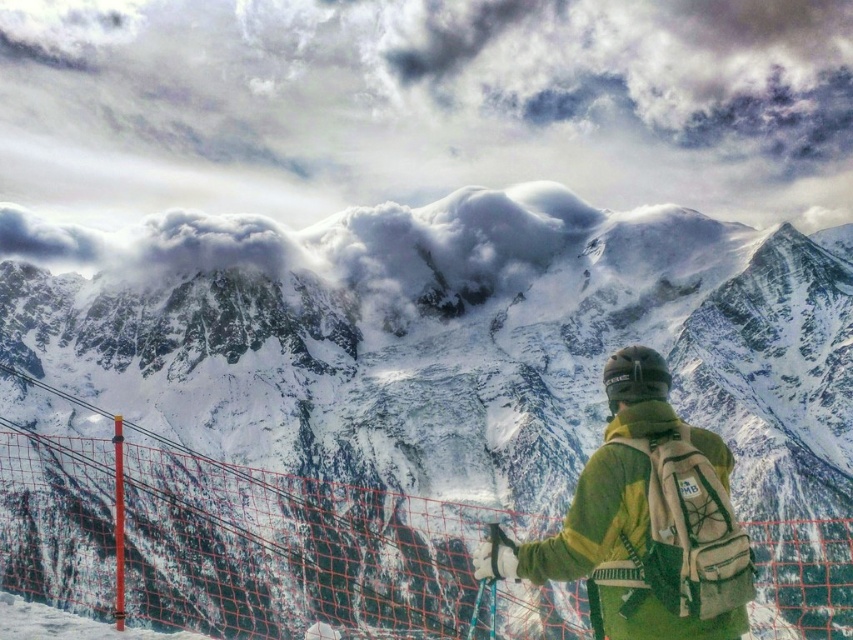
You are a photographer positioned at the camera location in this alpine scene. You want to capture a closeup shot of the point at coordinate point (316, 323). Given that your telephoto lens has a maximum focal length of 200mm, can you determine if you can achieve this closeup without moving closer?

The distance between point (316, 323) and the camera is 155.49 meters. With a telephoto lens of 200mm, you can capture a closeup of the point at (316, 323) from this distance.

You are a photographer positioned at the point closest to the camera in the scene. You want to take a photo of the two points labeled as point (751,248) and point (712,625). Which point should you focus on first to ensure both are in sharp focus?

You should focus on point (751,248) first because it is closer to the camera than point (712,625). By focusing on the closer point, the depth of field will likely include the farther point as well, ensuring both are in sharp focus.